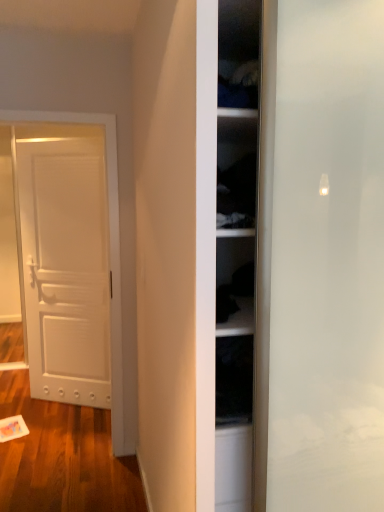
Locate an element on the screen. The height and width of the screenshot is (512, 384). vacant space situated on the left part of white matte door at left is located at coordinates click(x=24, y=401).